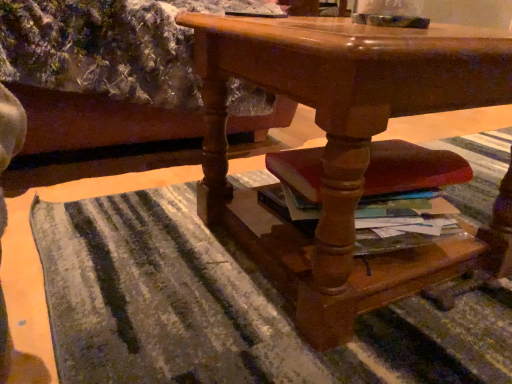
Image resolution: width=512 pixels, height=384 pixels. What are the coordinates of `glossy wood desk at center` in the screenshot? It's located at (346, 150).

Describe the element at coordinates (346, 150) in the screenshot. The height and width of the screenshot is (384, 512). I see `glossy wood desk at center` at that location.

Identify the location of glossy wood desk at center. The image size is (512, 384). (346, 150).